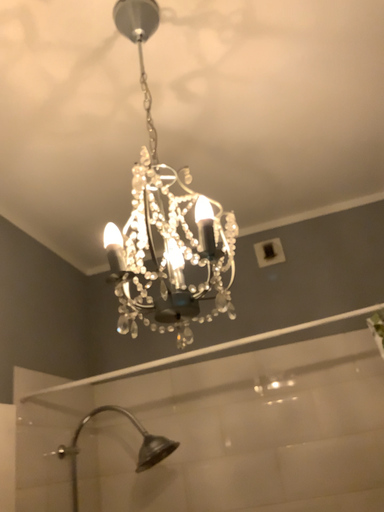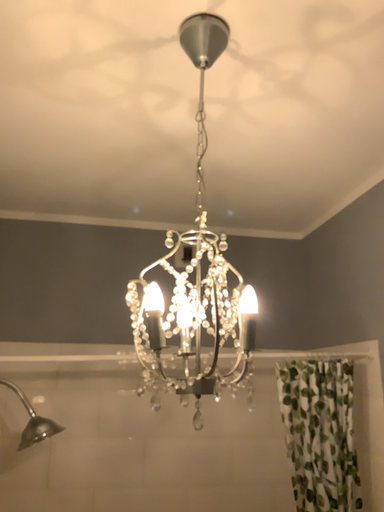
Question: How did the camera likely rotate when shooting the video?

Choices:
 (A) rotated left
 (B) rotated right

Answer: (B)